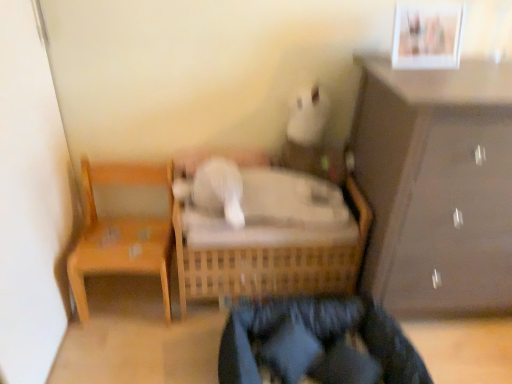
Identify the location of vacant space in wooden chair at left (from a real-world perspective). This screenshot has width=512, height=384. (130, 294).